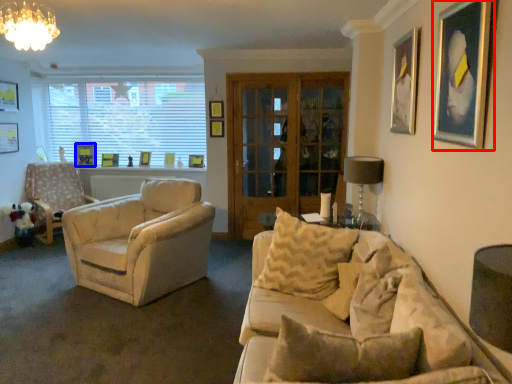
Question: Which object appears closest to the camera in this image, picture frame (highlighted by a red box) or picture frame (highlighted by a blue box)?

Choices:
 (A) picture frame
 (B) picture frame

Answer: (A)